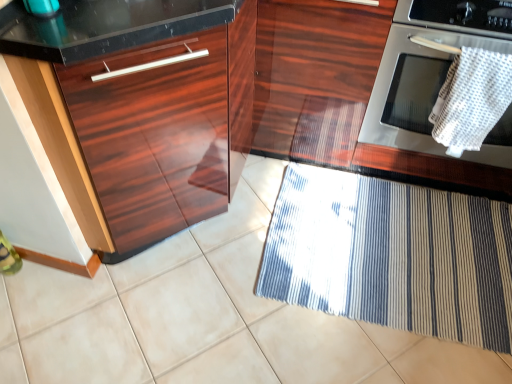
Question: From a real-world perspective, is stainless steel oven at right physically below white woven towel at upper right?

Choices:
 (A) no
 (B) yes

Answer: (B)

Question: From the image's perspective, is stainless steel oven at right beneath white woven towel at upper right?

Choices:
 (A) no
 (B) yes

Answer: (A)

Question: Can you confirm if stainless steel oven at right is shorter than white woven towel at upper right?

Choices:
 (A) yes
 (B) no

Answer: (B)

Question: Is there a large distance between stainless steel oven at right and white woven towel at upper right?

Choices:
 (A) no
 (B) yes

Answer: (A)

Question: Is white woven towel at upper right a part of stainless steel oven at right?

Choices:
 (A) yes
 (B) no

Answer: (B)

Question: Is stainless steel oven at right with white woven towel at upper right?

Choices:
 (A) no
 (B) yes

Answer: (A)

Question: Does glossy wood drawer at left come in front of white woven towel at upper right?

Choices:
 (A) no
 (B) yes

Answer: (B)

Question: Does glossy wood drawer at left touch white woven towel at upper right?

Choices:
 (A) yes
 (B) no

Answer: (B)

Question: From a real-world perspective, does glossy wood drawer at left sit lower than white woven towel at upper right?

Choices:
 (A) yes
 (B) no

Answer: (A)

Question: Is glossy wood drawer at left shorter than white woven towel at upper right?

Choices:
 (A) no
 (B) yes

Answer: (A)

Question: From the image's perspective, would you say glossy wood drawer at left is shown under white woven towel at upper right?

Choices:
 (A) yes
 (B) no

Answer: (A)

Question: From the image's perspective, is glossy wood drawer at left above white woven towel at upper right?

Choices:
 (A) no
 (B) yes

Answer: (A)

Question: Is blue striped mat at lower right aimed at white woven towel at upper right?

Choices:
 (A) yes
 (B) no

Answer: (B)